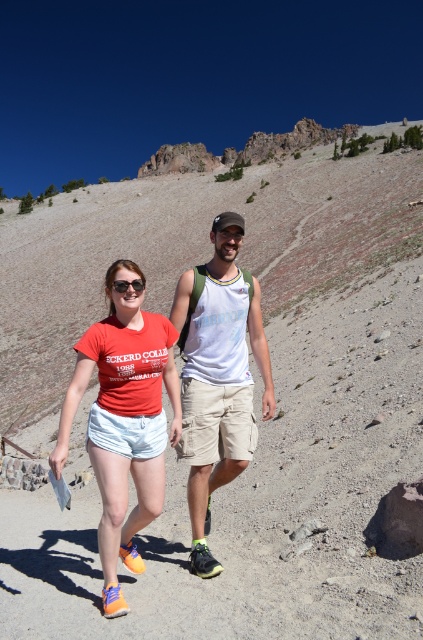
Question: Which point is closer to the camera taking this photo?

Choices:
 (A) (118, 401)
 (B) (263, 356)
 (C) (118, 284)

Answer: (A)

Question: Which object is farther from the camera taking this photo?

Choices:
 (A) matte red t-shirt at center
 (B) white cotton tank top at center

Answer: (B)

Question: Is matte red t-shirt at center thinner than matte black sunglasses at center?

Choices:
 (A) yes
 (B) no

Answer: (B)

Question: Is matte red t-shirt at center wider than matte black sunglasses at center?

Choices:
 (A) yes
 (B) no

Answer: (A)

Question: Estimate the real-world distances between objects in this image. Which object is farther from the matte black sunglasses at center?

Choices:
 (A) white cotton tank top at center
 (B) matte red t-shirt at center

Answer: (B)

Question: Can you confirm if matte red t-shirt at center is positioned above white cotton tank top at center?

Choices:
 (A) no
 (B) yes

Answer: (A)